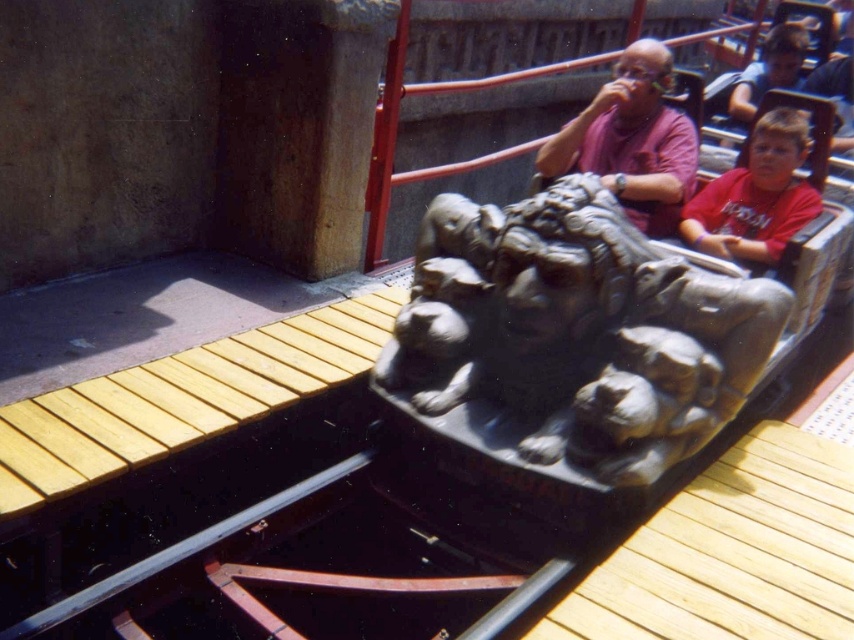
Question: Among these points, which one is nearest to the camera?

Choices:
 (A) (632, 161)
 (B) (495, 266)
 (C) (740, 208)

Answer: (B)

Question: Can you confirm if matte purple shirt at center is positioned to the left of red cotton shirt at right?

Choices:
 (A) yes
 (B) no

Answer: (A)

Question: Based on their relative distances, which object is farther from the red cotton shirt at right?

Choices:
 (A) gray stone lion at center
 (B) matte purple shirt at center

Answer: (A)

Question: Among these points, which one is farthest from the camera?

Choices:
 (A) pyautogui.click(x=699, y=396)
 (B) pyautogui.click(x=776, y=243)

Answer: (B)

Question: From the image, what is the correct spatial relationship of gray stone lion at center in relation to red cotton shirt at right?

Choices:
 (A) right
 (B) left

Answer: (B)

Question: Does matte purple shirt at center appear over red cotton shirt at right?

Choices:
 (A) no
 (B) yes

Answer: (B)